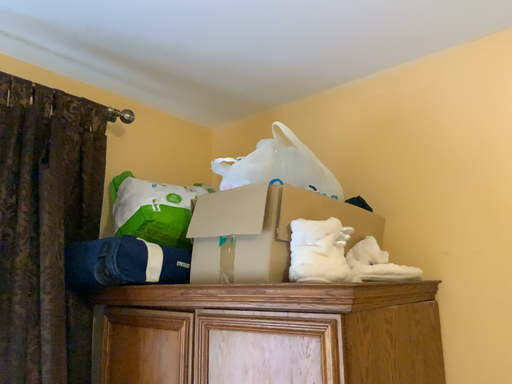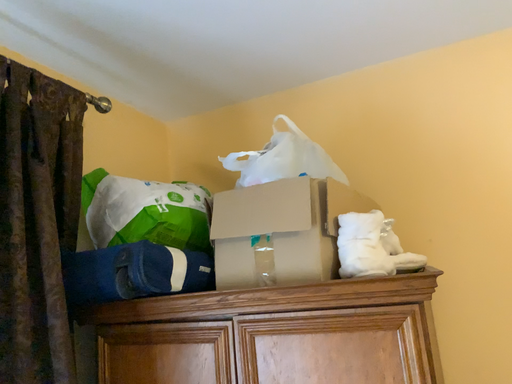
Question: Which way did the camera rotate in the video?

Choices:
 (A) rotated left
 (B) rotated right

Answer: (B)